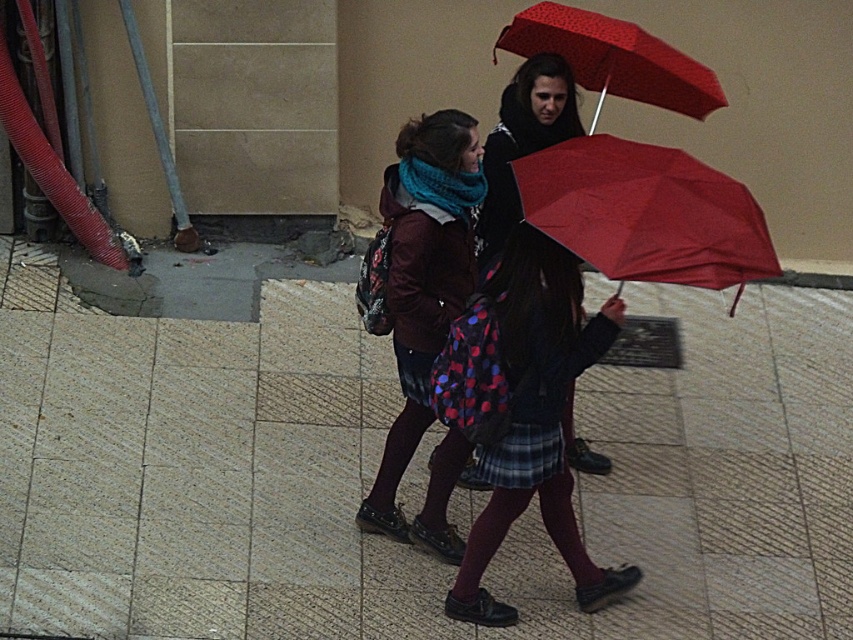
The height and width of the screenshot is (640, 853). Identify the location of matte maroon jacket at center. (425, 308).

Between matte maroon jacket at center and red dotted umbrella at upper center, which one is positioned lower?

matte maroon jacket at center is below.

The width and height of the screenshot is (853, 640). What do you see at coordinates (425, 308) in the screenshot? I see `matte maroon jacket at center` at bounding box center [425, 308].

At what (x,y) coordinates should I click in order to perform the action: click on matte maroon jacket at center. Please return your answer as a coordinate pair (x, y). This screenshot has width=853, height=640. Looking at the image, I should click on (425, 308).

Looking at this image, can you confirm if polka dot fabric dress at center is shorter than red dotted umbrella at upper center?

In fact, polka dot fabric dress at center may be taller than red dotted umbrella at upper center.

Which of these two, polka dot fabric dress at center or red dotted umbrella at upper center, stands shorter?

With less height is red dotted umbrella at upper center.

Image resolution: width=853 pixels, height=640 pixels. Identify the location of polka dot fabric dress at center. (537, 420).

The image size is (853, 640). I want to click on polka dot fabric dress at center, so click(537, 420).

Does polka dot fabric dress at center have a lesser height compared to matte black jacket at center?

Incorrect, polka dot fabric dress at center's height does not fall short of matte black jacket at center's.

Does point (618, 310) come farther from viewer compared to point (543, 60)?

No, (618, 310) is in front of (543, 60).

I want to click on polka dot fabric dress at center, so click(x=537, y=420).